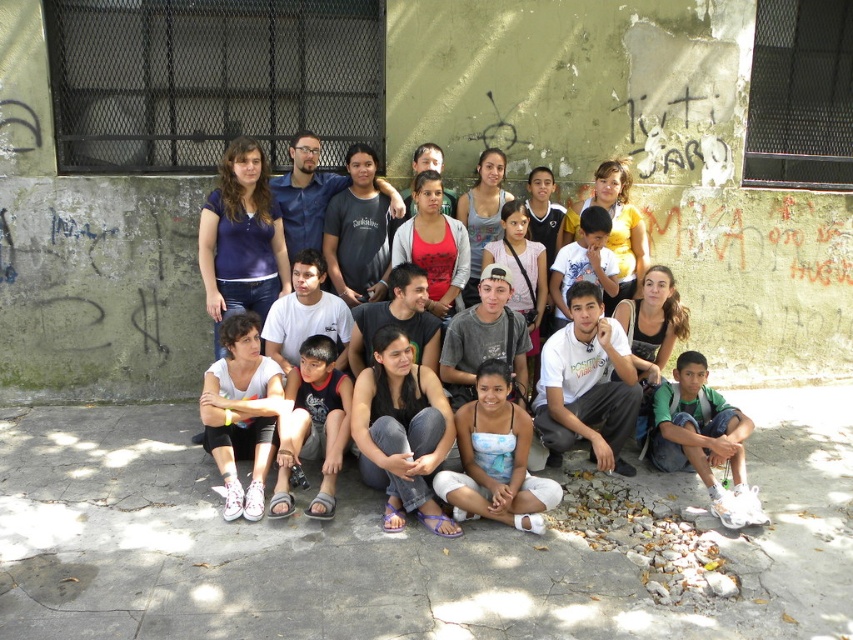
Does jeans at center have a lesser height compared to blue printed tank top at center?

In fact, jeans at center may be taller than blue printed tank top at center.

This screenshot has height=640, width=853. Describe the element at coordinates (401, 432) in the screenshot. I see `jeans at center` at that location.

Is point (370, 372) farther from camera compared to point (495, 403)?

That is True.

What are the coordinates of `jeans at center` in the screenshot? It's located at (401, 432).

Measure the distance between blue printed tank top at center and white fabric shirt at lower left.

They are 4.73 feet apart.

Does blue printed tank top at center appear on the left side of white fabric shirt at lower left?

Incorrect, blue printed tank top at center is not on the left side of white fabric shirt at lower left.

Locate an element on the screen. blue printed tank top at center is located at coordinates (495, 458).

Does jeans at center have a lesser height compared to white fabric shirt at lower left?

Correct, jeans at center is not as tall as white fabric shirt at lower left.

Can you confirm if jeans at center is wider than white fabric shirt at lower left?

Yes.

Between point (364, 433) and point (254, 404), which one is positioned in front?

Positioned in front is point (364, 433).

Find the location of a particular element. The width and height of the screenshot is (853, 640). jeans at center is located at coordinates (401, 432).